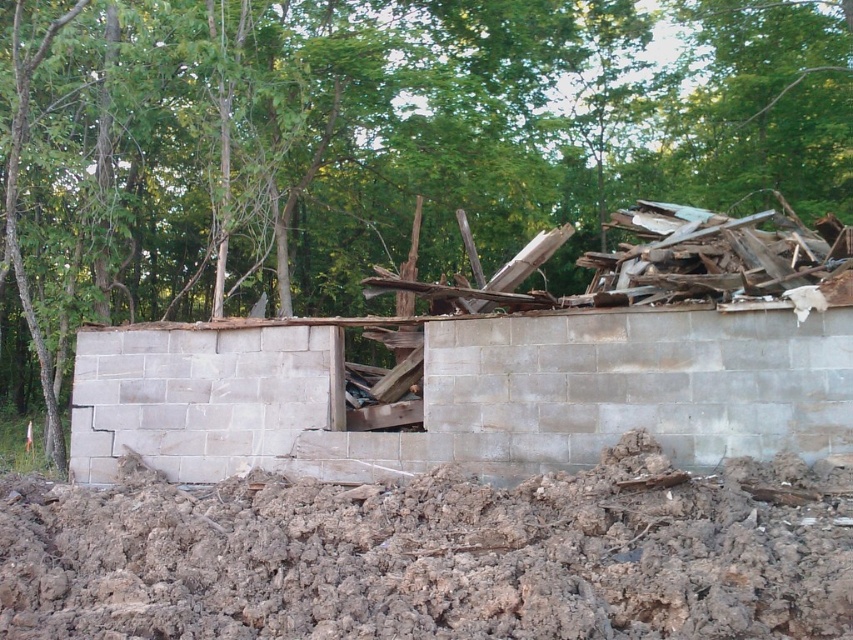
Question: Which point is farther from the camera taking this photo?

Choices:
 (A) (627, 134)
 (B) (96, 429)
 (C) (621, 506)
 (D) (787, 371)

Answer: (A)

Question: Is brown dirt at lower center below gray concrete wall at center?

Choices:
 (A) no
 (B) yes

Answer: (B)

Question: Can you confirm if gray concrete wall at center is positioned above gray concrete block at center?

Choices:
 (A) no
 (B) yes

Answer: (B)

Question: Does green leafy tree at upper center appear on the left side of gray concrete wall at center?

Choices:
 (A) no
 (B) yes

Answer: (A)

Question: Which point is closer to the camera?

Choices:
 (A) brown dirt at lower center
 (B) gray concrete wall at center
 (C) gray concrete block at center
 (D) green leafy tree at upper center

Answer: (A)

Question: Which object is closer to the camera taking this photo?

Choices:
 (A) gray concrete wall at center
 (B) gray concrete block at center
 (C) green leafy tree at upper center
 (D) brown dirt at lower center

Answer: (D)